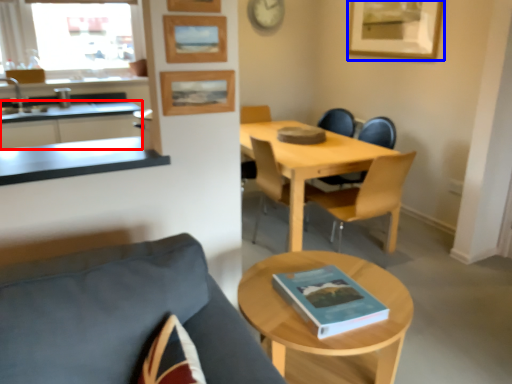
Question: Which of the following is the farthest to the observer, cabinetry (highlighted by a red box) or picture frame (highlighted by a blue box)?

Choices:
 (A) cabinetry
 (B) picture frame

Answer: (B)